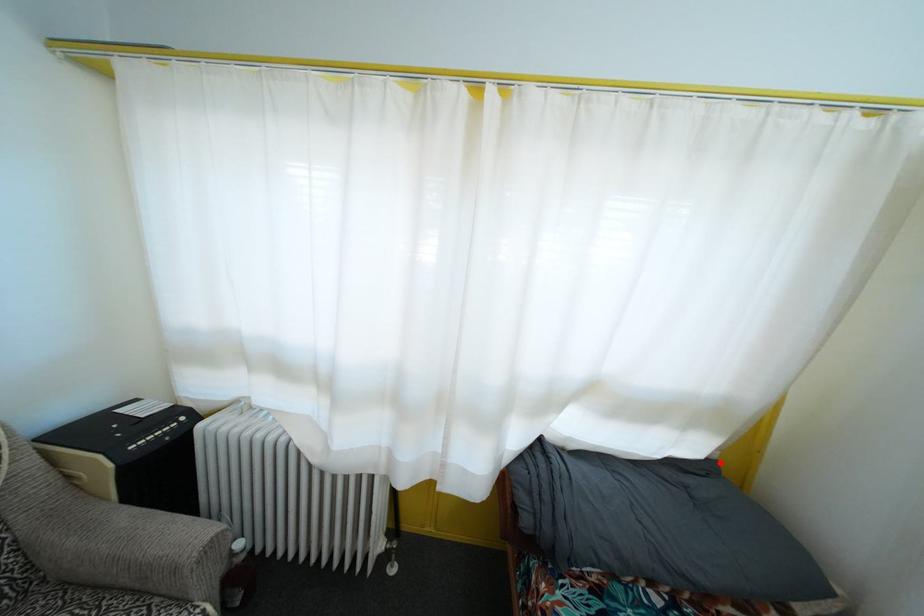
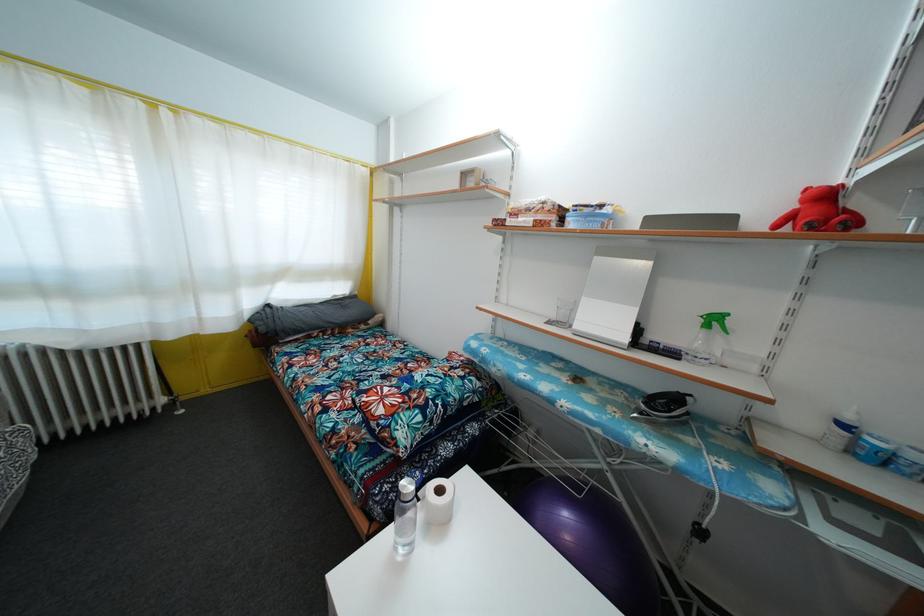
Question: I am providing you with two images of the same scene from different viewpoints. A red point is marked on the first image. Can you still see the location of the red point in image 2?

Choices:
 (A) Yes
 (B) No

Answer: (A)